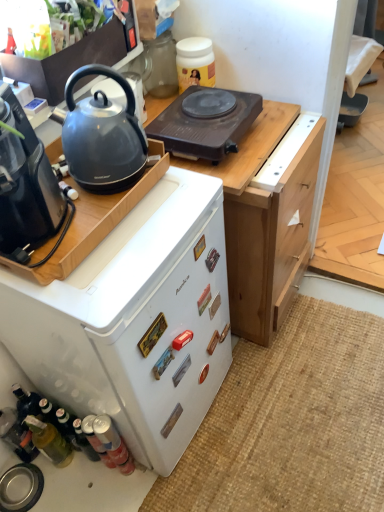
Question: Is black plastic coffee maker at left inside or outside of metallic silver sink at lower left, the 3th kitchen appliance in the top-to-bottom sequence?

Choices:
 (A) outside
 (B) inside

Answer: (A)

Question: Is black plastic coffee maker at left in front of or behind metallic silver sink at lower left, the 1th kitchen appliance ordered from the bottom, in the image?

Choices:
 (A) behind
 (B) front

Answer: (B)

Question: Which object is the farthest from the brown plastic electric hot plate at upper center?

Choices:
 (A) matte black coffee maker at left, acting as the second kitchen appliance starting from the bottom
 (B) satin black kettle at upper left, which appears as the first kitchen appliance when viewed from the top
 (C) white matte refrigerator at center-left
 (D) burlap mat at lower right
 (E) matte black kettle at left

Answer: (D)

Question: Which of these objects is positioned closest to the white matte refrigerator at center-left?

Choices:
 (A) matte black coffee maker at left, which ranks as the 2th kitchen appliance in top-to-bottom order
 (B) brown plastic electric hot plate at upper center
 (C) burlap mat at lower right
 (D) metallic silver sink at lower left, the 1th kitchen appliance ordered from the bottom
 (E) black plastic coffee maker at left

Answer: (A)